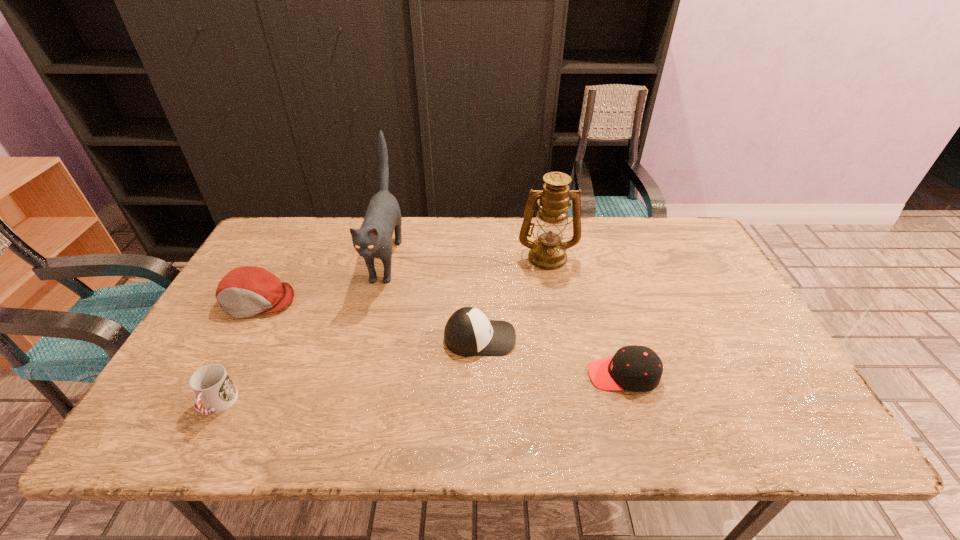
Locate an element on the screen. vacant space that's between the rightmost cap and the leftmost cap is located at coordinates pyautogui.click(x=441, y=338).

What are the coordinates of `free area in between the leftmost cap and the rightmost cap` in the screenshot? It's located at (441, 338).

Identify the location of vacant space that's between the leftmost cap and the rightmost cap. (441, 338).

You are a GUI agent. You are given a task and a screenshot of the screen. Output one action in this format:
    pyautogui.click(x=<x>, y=<y>)
    Task: Click on the free point between the cat and the third object from right to left
    
    Given the screenshot: What is the action you would take?
    pyautogui.click(x=433, y=299)

Where is `the fourth closest object to the oil lamp`? The width and height of the screenshot is (960, 540). the fourth closest object to the oil lamp is located at coordinates (246, 291).

Find the location of a particular element. Image resolution: width=960 pixels, height=540 pixels. object that is the second nearest to the leftmost cap is located at coordinates (212, 385).

Image resolution: width=960 pixels, height=540 pixels. Identify the location of the second closest cap to the rightmost cap. [246, 291].

I want to click on cap that stands as the closest to the leftmost cap, so click(x=468, y=332).